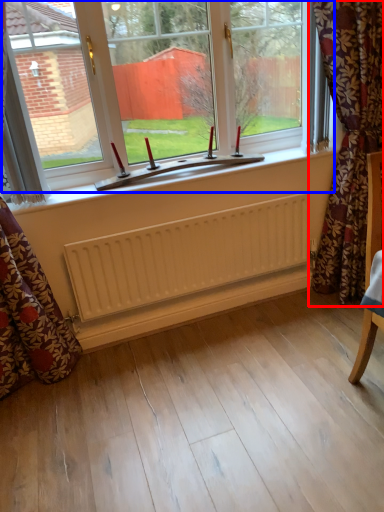
Question: Which object appears closest to the camera in this image, curtain (highlighted by a red box) or window (highlighted by a blue box)?

Choices:
 (A) curtain
 (B) window

Answer: (A)